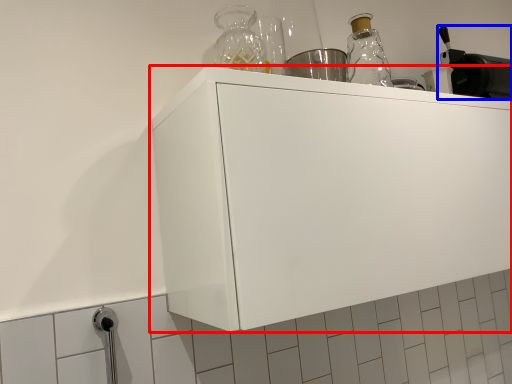
Question: Which object appears farthest to the camera in this image, cabinetry (highlighted by a red box) or appliance (highlighted by a blue box)?

Choices:
 (A) cabinetry
 (B) appliance

Answer: (B)